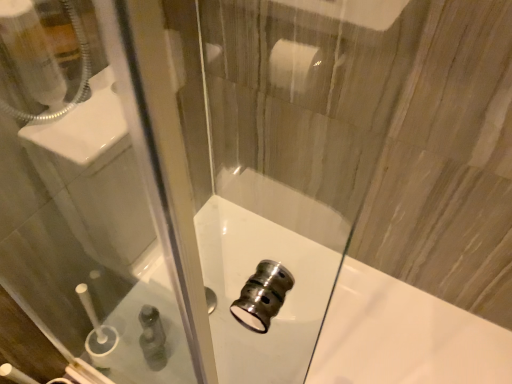
Question: Considering the relative positions of green plastic bottle at lower left and polished chrome faucet at center in the image provided, is green plastic bottle at lower left to the left of polished chrome faucet at center from the viewer's perspective?

Choices:
 (A) yes
 (B) no

Answer: (A)

Question: Would you say green plastic bottle at lower left is a long distance from polished chrome faucet at center?

Choices:
 (A) yes
 (B) no

Answer: (B)

Question: Does green plastic bottle at lower left have a larger size compared to polished chrome faucet at center?

Choices:
 (A) yes
 (B) no

Answer: (B)

Question: From a real-world perspective, is green plastic bottle at lower left below polished chrome faucet at center?

Choices:
 (A) yes
 (B) no

Answer: (B)

Question: Is green plastic bottle at lower left shorter than polished chrome faucet at center?

Choices:
 (A) yes
 (B) no

Answer: (B)

Question: Is green plastic bottle at lower left beside polished chrome faucet at center?

Choices:
 (A) no
 (B) yes

Answer: (A)

Question: Considering the relative positions of polished chrome faucet at center and green plastic bottle at lower left in the image provided, is polished chrome faucet at center to the left of green plastic bottle at lower left from the viewer's perspective?

Choices:
 (A) yes
 (B) no

Answer: (B)

Question: Are polished chrome faucet at center and green plastic bottle at lower left located far from each other?

Choices:
 (A) yes
 (B) no

Answer: (B)

Question: Is polished chrome faucet at center closer to camera compared to green plastic bottle at lower left?

Choices:
 (A) no
 (B) yes

Answer: (B)

Question: Does polished chrome faucet at center turn towards green plastic bottle at lower left?

Choices:
 (A) no
 (B) yes

Answer: (A)

Question: Can you confirm if polished chrome faucet at center is taller than green plastic bottle at lower left?

Choices:
 (A) yes
 (B) no

Answer: (B)

Question: Could green plastic bottle at lower left be considered to be inside polished chrome faucet at center?

Choices:
 (A) no
 (B) yes

Answer: (A)

Question: Is green plastic bottle at lower left wider or thinner than polished chrome faucet at center?

Choices:
 (A) wide
 (B) thin

Answer: (B)